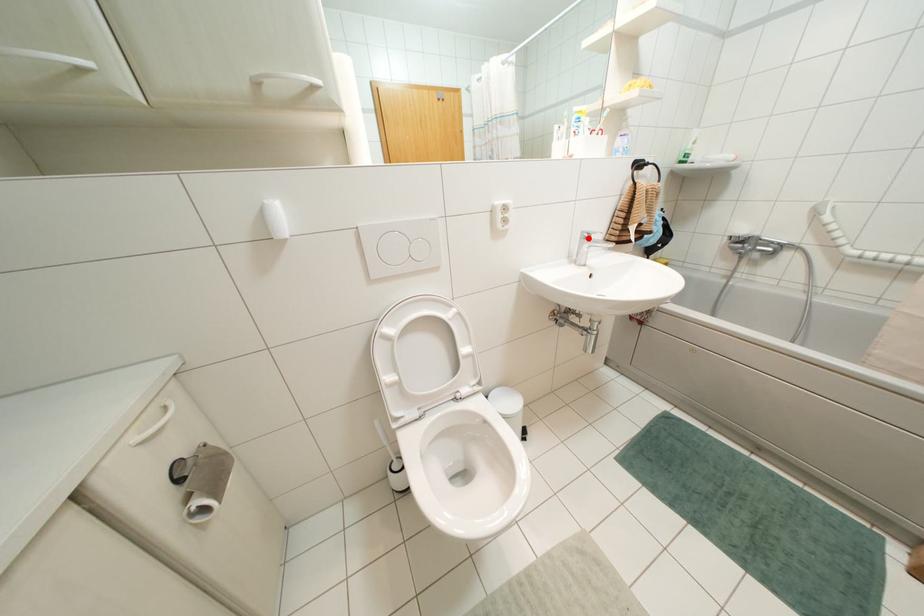
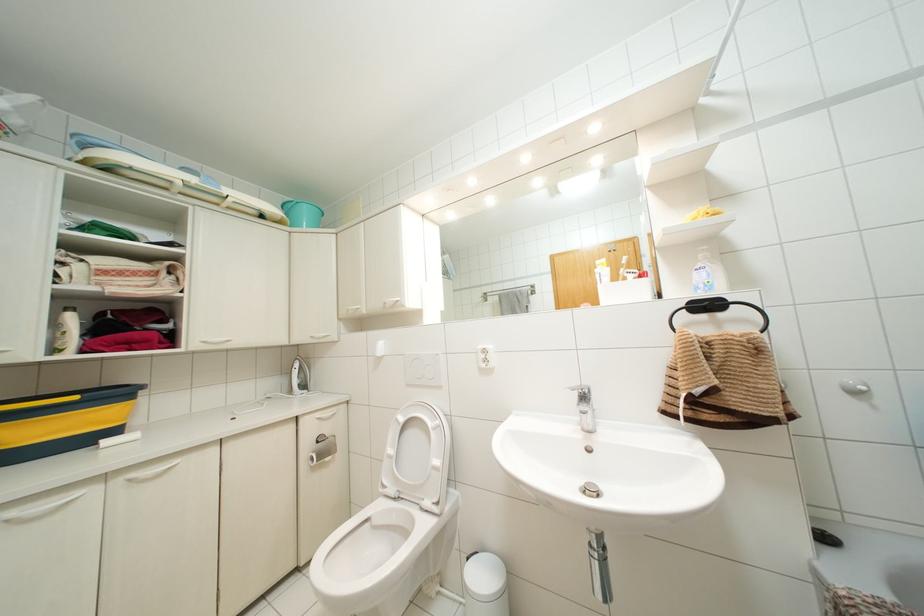
Question: I am providing you with two images of the same scene from different viewpoints. In image1, a red point is highlighted. Considering the same 3D point in image2, which of the following is correct?

Choices:
 (A) It is closer
 (B) It is farther

Answer: (B)